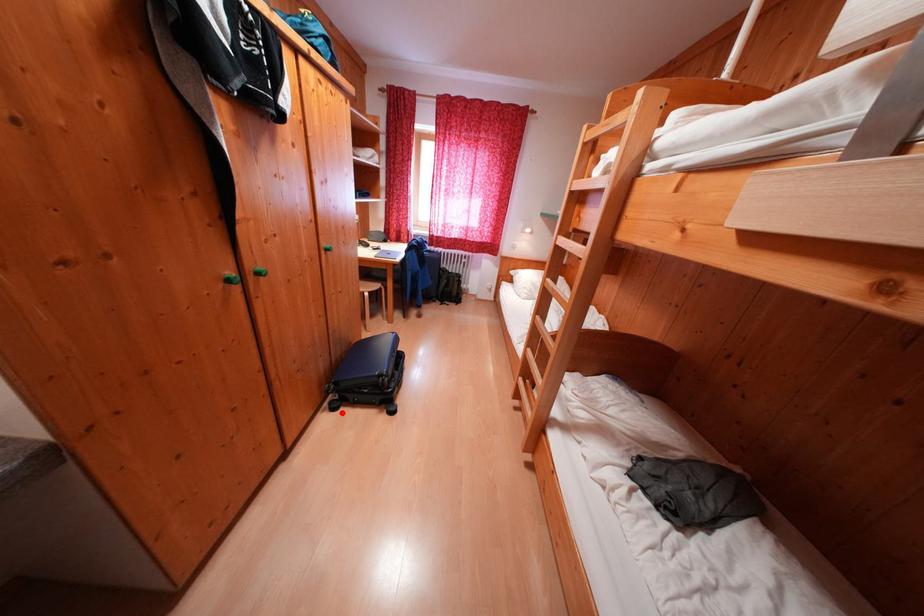
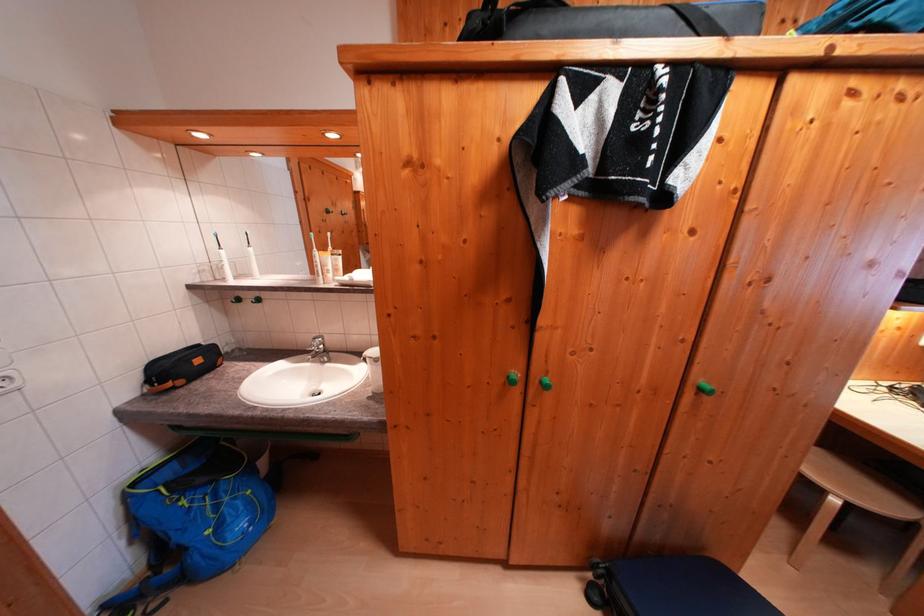
Question: I am providing you with two images of the same scene from different viewpoints. A red point is shown in image1. For the corresponding object point in image2, is it positioned nearer or farther from the camera?

Choices:
 (A) Nearer
 (B) Farther

Answer: (A)